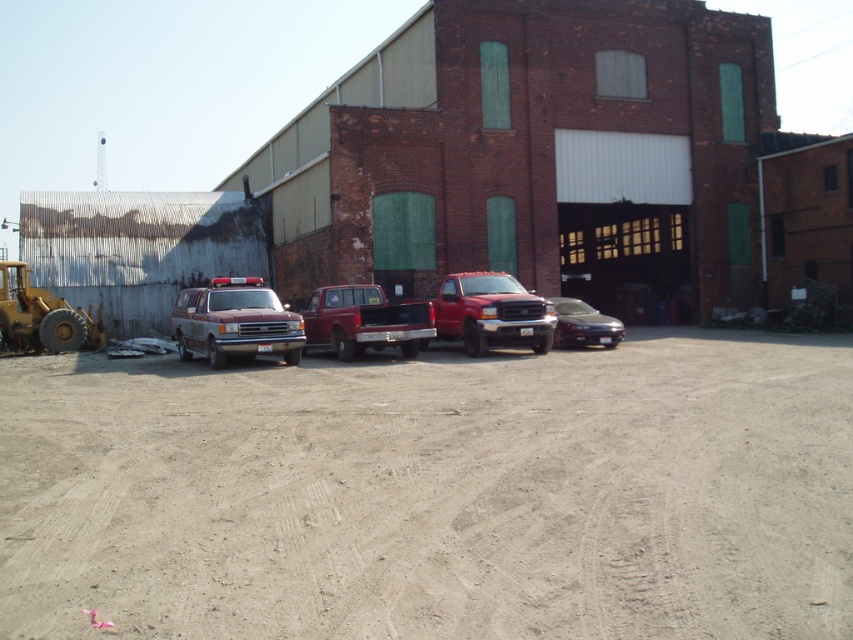
Question: Estimate the real-world distances between objects in this image. Which object is farther from the satin silver sedan at center?

Choices:
 (A) matte red truck at center
 (B) dirt at center
 (C) yellow metallic bulldozer at left

Answer: (C)

Question: Can you confirm if dirt at center is positioned to the left of satin silver sedan at center?

Choices:
 (A) no
 (B) yes

Answer: (B)

Question: Where is dirt at center located in relation to yellow metallic bulldozer at left in the image?

Choices:
 (A) above
 (B) below

Answer: (B)

Question: Which object is closer to the camera taking this photo?

Choices:
 (A) yellow metallic bulldozer at left
 (B) dirt at center

Answer: (B)

Question: Does maroon matte van at center come in front of yellow metallic bulldozer at left?

Choices:
 (A) yes
 (B) no

Answer: (A)

Question: Which is nearer to the matte red truck at center?

Choices:
 (A) yellow metallic bulldozer at left
 (B) satin silver sedan at center
 (C) dirt at center
 (D) maroon matte van at center

Answer: (B)